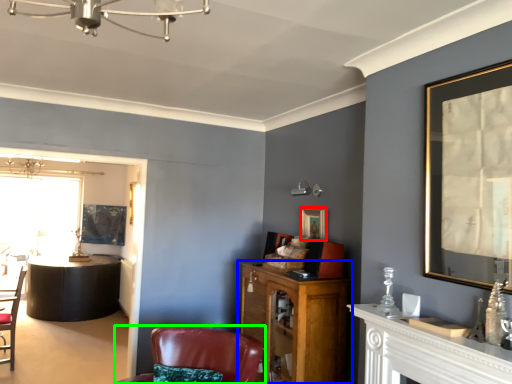
Question: Which is nearer to the picture frame (highlighted by a red box)? cabinetry (highlighted by a blue box) or chair (highlighted by a green box).

Choices:
 (A) cabinetry
 (B) chair

Answer: (A)